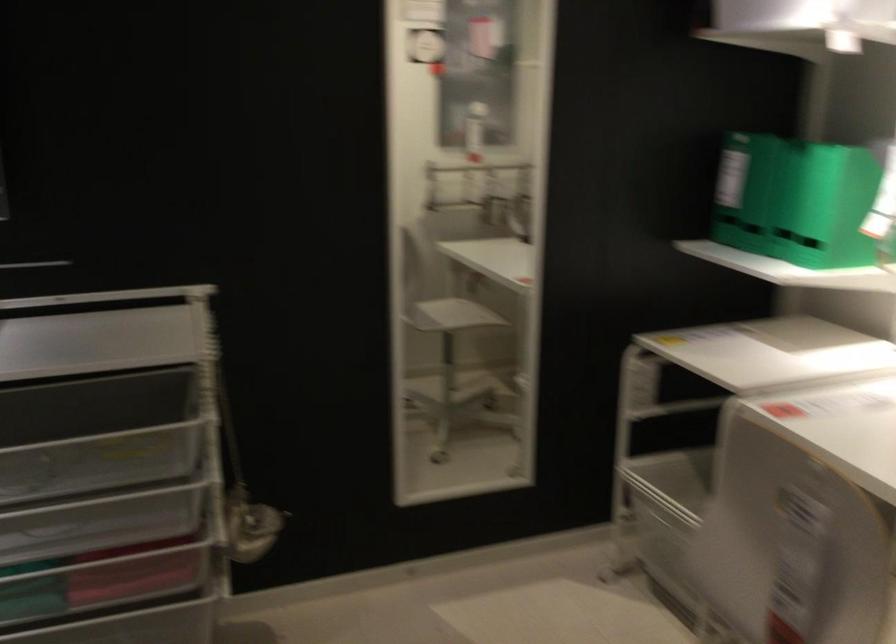
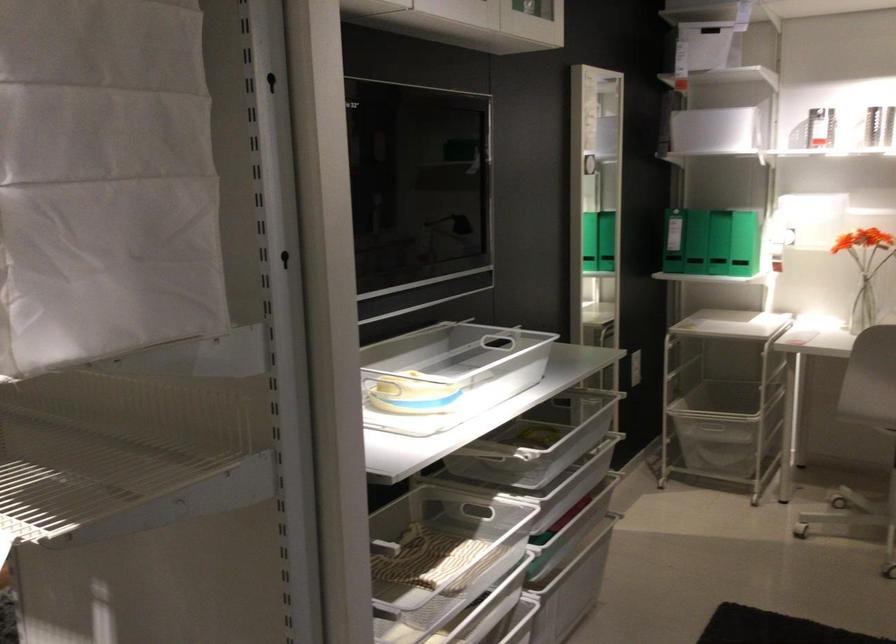
Locate, in the second image, the point that corresponds to pixel 709 212 in the first image.

(695, 242)